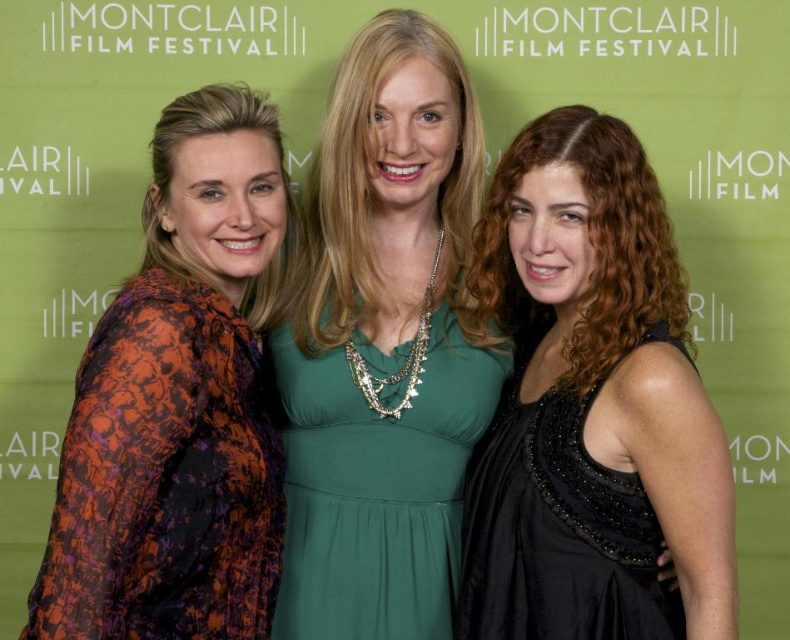
You are a photographer at the Montclair Film Festival. You need to adjust the lighting so that both the emerald green jersey dress at center and the black satin dress at right are equally visible. Which dress is currently farther from the camera, and why does this matter?

The black satin dress at right is farther from the camera because it is behind the emerald green jersey dress at center. This matters because the dress farther away may receive less light, requiring adjustment to ensure even illumination.

You are a photographer at the Montclair Film Festival. You need to decide which dress to recommend for a closeup shot. The orange floral dress at left and the black satin dress at right are options. Which dress should you choose if you want the one that is larger in size?

The orange floral dress at left is bigger than the black satin dress at right, so you should choose the orange floral dress at left for the closeup shot since it is larger in size.

You are standing 6 feet away from the backdrop of the Montclair Film Festival. You see the emerald green jersey dress at center. Can you determine if you are closer to the dress than the backdrop?

The emerald green jersey dress at center is 5.86 feet away from the viewer, which is less than the 6 feet distance to the backdrop. Therefore, you are closer to the dress than the backdrop.